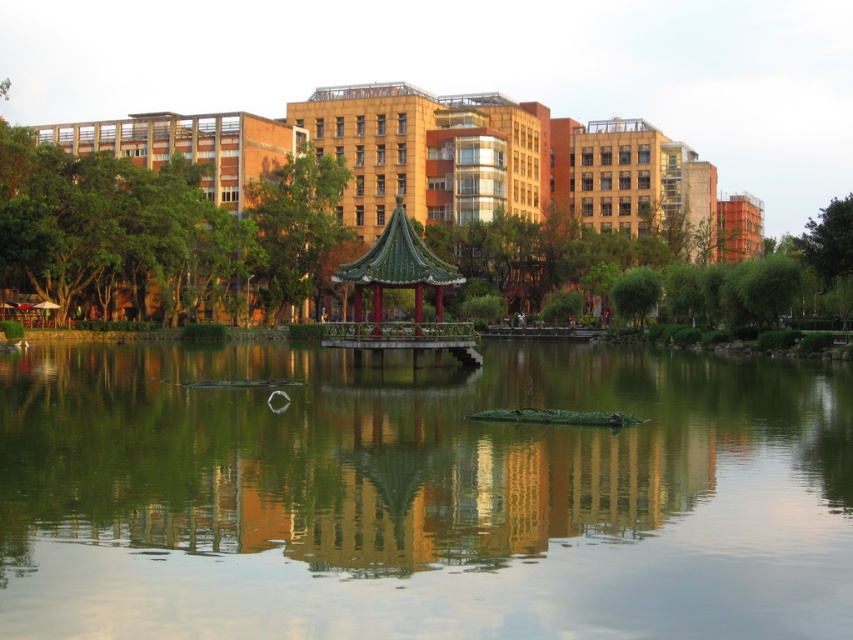
Question: Which object appears closest to the camera in this image?

Choices:
 (A) green glazed tile gazebo at center
 (B) green reflective water at center

Answer: (B)

Question: Does green reflective water at center appear over green glazed tile gazebo at center?

Choices:
 (A) yes
 (B) no

Answer: (B)

Question: Does green reflective water at center come behind green glazed tile gazebo at center?

Choices:
 (A) yes
 (B) no

Answer: (B)

Question: Can you confirm if green reflective water at center is wider than green glazed tile gazebo at center?

Choices:
 (A) no
 (B) yes

Answer: (B)